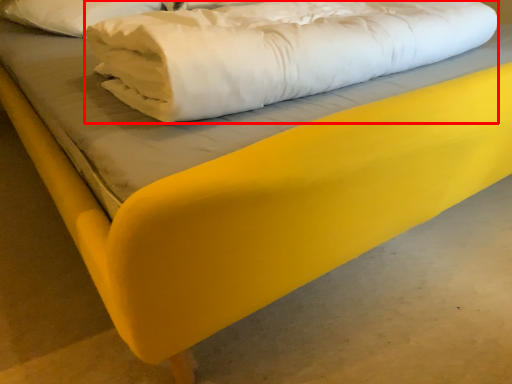
Question: From the image's perspective, what is the correct spatial relationship of sheet (annotated by the red box) in relation to pillow?

Choices:
 (A) below
 (B) above

Answer: (A)